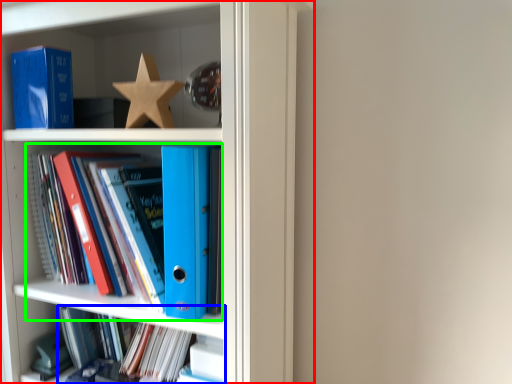
Question: Which object is positioned closest to bookcase (highlighted by a red box)? Select from book (highlighted by a blue box) and book (highlighted by a green box).

Choices:
 (A) book
 (B) book

Answer: (B)